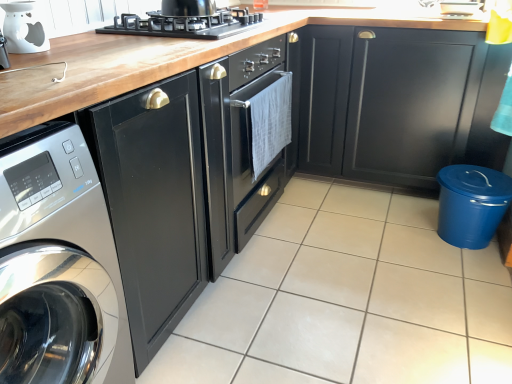
You are a GUI agent. You are given a task and a screenshot of the screen. Output one action in this format:
    pyautogui.click(x=<x>, y=<y>)
    Task: Click on the empty space that is ontop of white glossy tile at center (from a real-world perspective)
    The height and width of the screenshot is (384, 512).
    Given the screenshot: What is the action you would take?
    pyautogui.click(x=344, y=259)